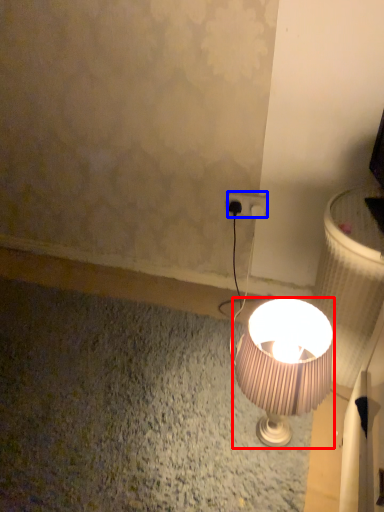
Question: Which point is closer to the camera, lamp (highlighted by a red box) or power plugs and sockets (highlighted by a blue box)?

Choices:
 (A) lamp
 (B) power plugs and sockets

Answer: (A)